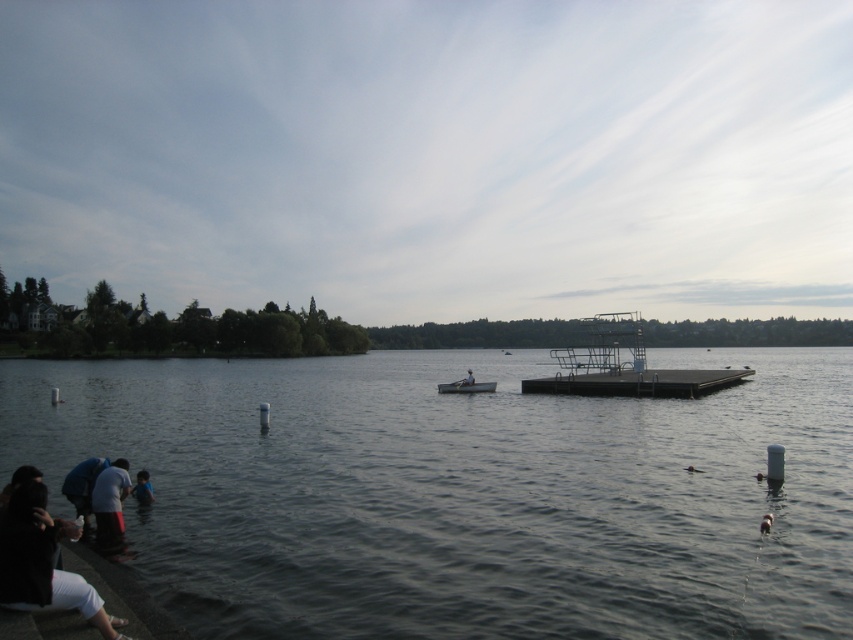
From the picture: Between white matte shirt at lower left and blue fabric shirt at lower left, which one is positioned lower?

blue fabric shirt at lower left

Who is taller, white matte shirt at lower left or blue fabric shirt at lower left?

white matte shirt at lower left

Does point (94, 500) lie behind point (148, 502)?

No.

This screenshot has height=640, width=853. I want to click on white matte shirt at lower left, so click(109, 502).

Between black metal dock at center and white matte shirt at lower left, which one has more height?

white matte shirt at lower left is taller.

From the picture: Does black metal dock at center appear over white matte shirt at lower left?

Actually, black metal dock at center is below white matte shirt at lower left.

Is point (538, 392) closer to camera compared to point (96, 506)?

No, (538, 392) is behind (96, 506).

Locate an element on the screen. This screenshot has height=640, width=853. black metal dock at center is located at coordinates (637, 381).

Which is behind, point (674, 388) or point (447, 384)?

Point (447, 384)

Is point (697, 371) positioned after point (473, 381)?

Yes, it is behind point (473, 381).

Locate an element on the screen. black metal dock at center is located at coordinates (637, 381).